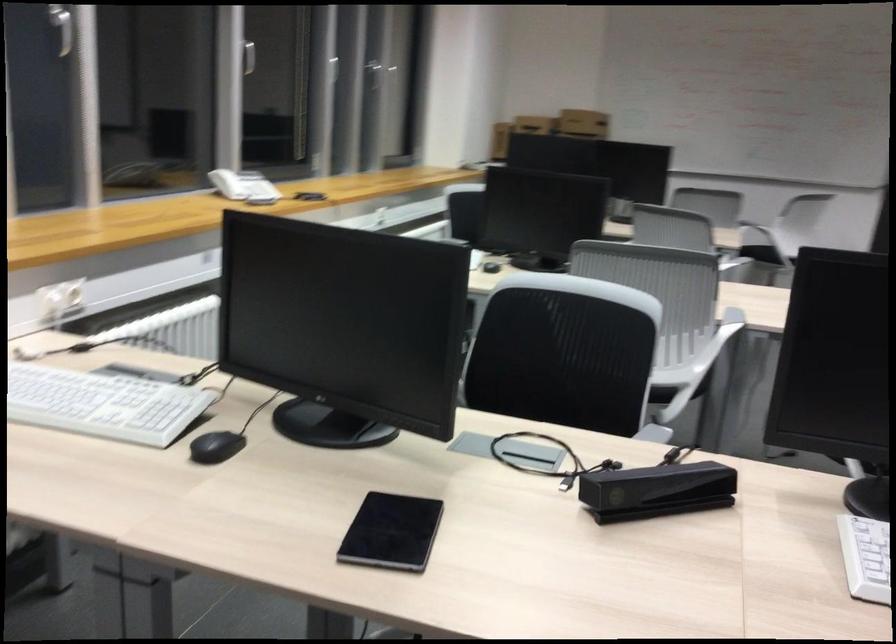
Where is `telephone handset`? telephone handset is located at coordinates (227, 184).